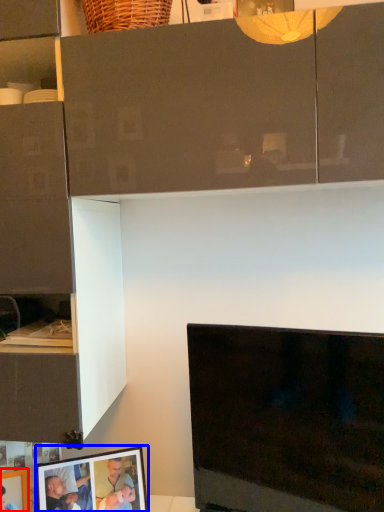
Question: Which object is closer to the camera taking this photo, picture frame (highlighted by a red box) or picture frame (highlighted by a blue box)?

Choices:
 (A) picture frame
 (B) picture frame

Answer: (A)